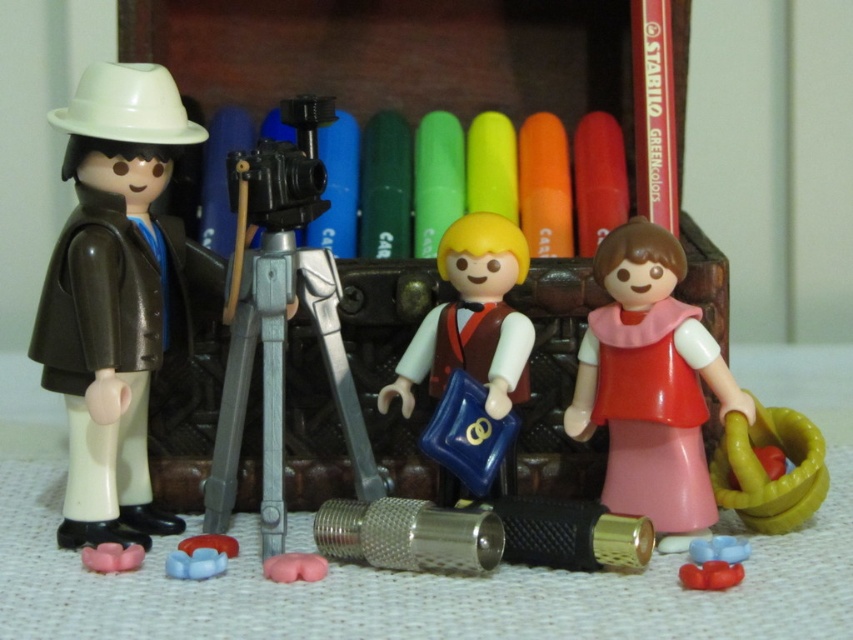
Based on the photo, you are a photographer setting up a scene with two points marked in the image. The first point is at coordinates point (146, 128) and the second is at point (755, 428). Which point is closer to the camera lens?

Point (146, 128) is in front of point (755, 428), so it is closer to the camera lens.

You are setting up a photo shoot and need to place a small decorative item between the pink matte dress at center and the orange matte crayon at center. Which object should you place the item closer to to ensure it fits better?

The orange matte crayon at center is smaller in size compared to the pink matte dress at center, so placing the decorative item closer to the orange matte crayon at center would allow it to fit better.

You are a photographer standing in front of the pink matte dress at center. You want to take a closeup shot without moving the dress. What should you do?

Since the pink matte dress at center is 91.90 centimeters away, you can move closer to it to take the closeup shot without needing to adjust its position.